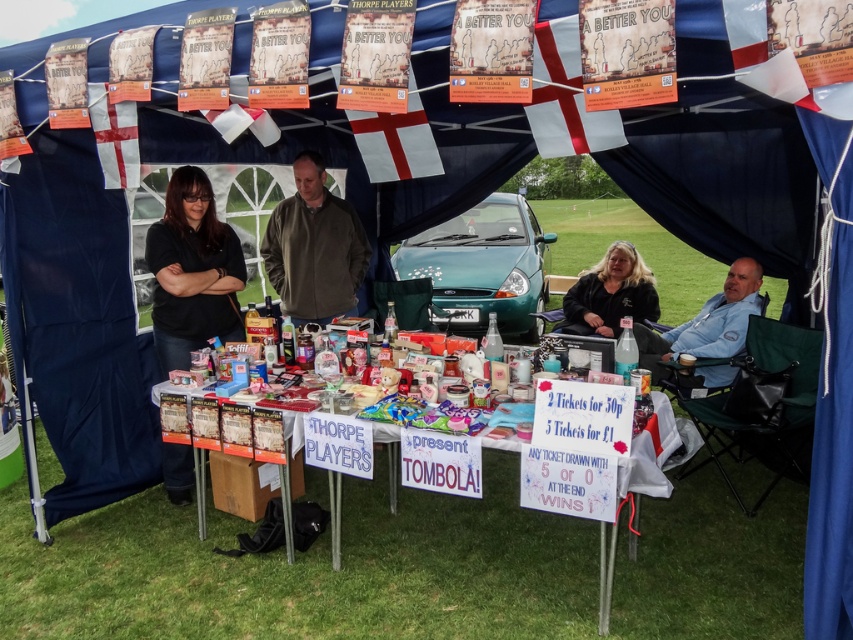
Is point (450, 504) less distant than point (613, 288)?

Yes, point (450, 504) is closer to viewer.

Can you confirm if metallic silver table at center is smaller than black fabric at center?

No, metallic silver table at center is not smaller than black fabric at center.

Does point (390, 529) come farther from viewer compared to point (601, 280)?

No, it is not.

The width and height of the screenshot is (853, 640). Identify the location of metallic silver table at center. (450, 520).

Which of these two, black matte shirt at left or black fabric at center, stands shorter?

black fabric at center

Where is `black matte shirt at left`? This screenshot has width=853, height=640. black matte shirt at left is located at coordinates point(192,272).

Who is more distant from viewer, [189,452] or [630,307]?

Point [630,307]

This screenshot has height=640, width=853. I want to click on black matte shirt at left, so click(192, 272).

Does green metallic car at center appear on the left side of green fleece jacket at center?

No, green metallic car at center is not to the left of green fleece jacket at center.

Identify the location of green metallic car at center. (483, 268).

Between point (534, 236) and point (341, 260), which one is positioned behind?

The point (534, 236) is more distant.

In order to click on green metallic car at center in this screenshot , I will do `click(483, 268)`.